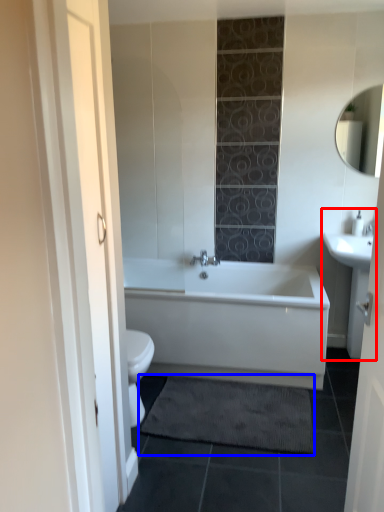
Question: Which object appears closest to the camera in this image, sink (highlighted by a red box) or bath mat (highlighted by a blue box)?

Choices:
 (A) sink
 (B) bath mat

Answer: (B)